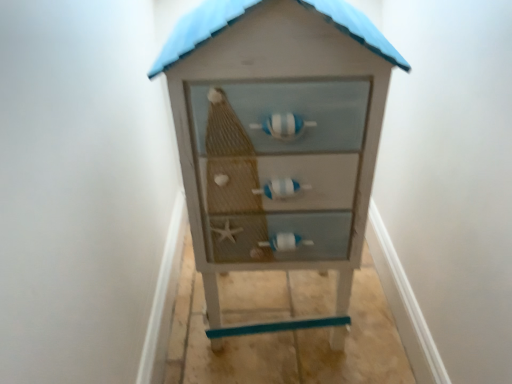
Describe the element at coordinates (276, 138) in the screenshot. I see `matte white chest of drawers at center` at that location.

The width and height of the screenshot is (512, 384). What are the coordinates of `matte white chest of drawers at center` in the screenshot? It's located at (276, 138).

Where is `matte white chest of drawers at center`? The image size is (512, 384). matte white chest of drawers at center is located at coordinates (276, 138).